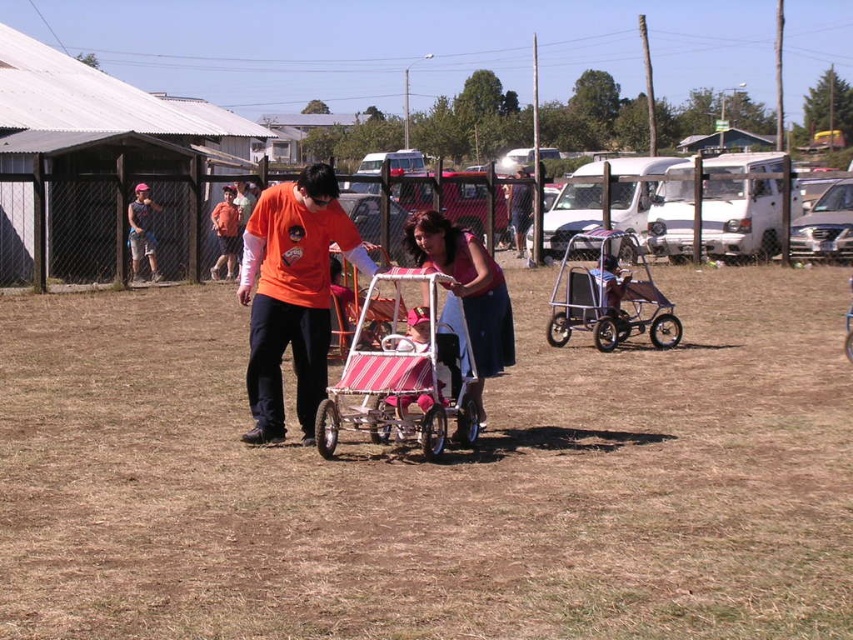
You are a photographer trying to capture a photo of the striped fabric stroller at center. You notice there is a person wearing an orange matte shirt at center in the way. Which direction should you move to avoid blocking the stroller?

Since the orange matte shirt at center is to the left of the striped fabric stroller at center, you should move to the right to avoid blocking the stroller.

You are a photographer trying to capture a clear photo of the pink fabric stroller at center without the brown dry grass at center in the background. Which side should you position yourself relative to the stroller to ensure the grass isn t in the shot?

To avoid the brown dry grass at center appearing in the background, position yourself to the right side of the pink fabric stroller at center since the grass is on its left side.

You are a photographer standing at the edge of the grassy field. You want to take a photo of the orange matte shirt at center. Where should you aim your camera to capture it?

The orange matte shirt at center is located at point 0.461 on the x axis and 0.343 on the y axis, so you should aim your camera at those coordinates to capture it.